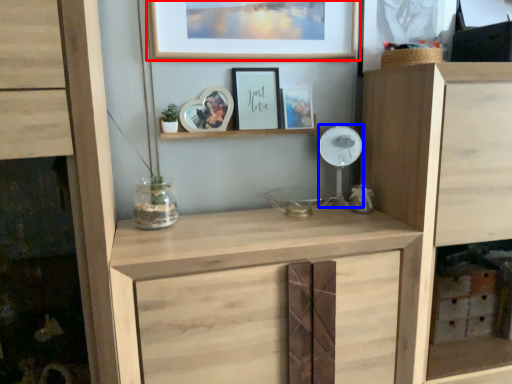
Question: Among these objects, which one is farthest to the camera, picture frame (highlighted by a red box) or fan (highlighted by a blue box)?

Choices:
 (A) picture frame
 (B) fan

Answer: (B)